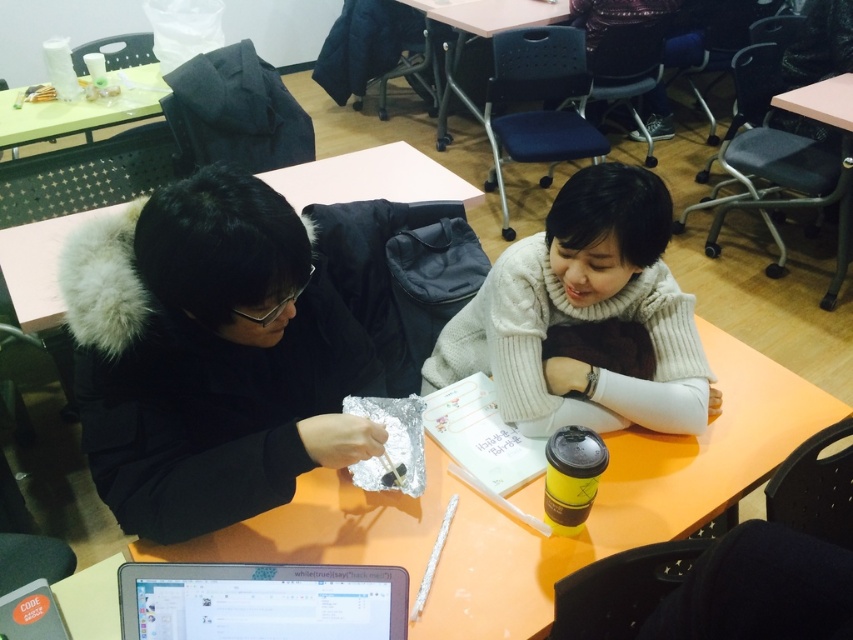
Question: Where is orange matte table at center located in relation to matte plastic table at center in the image?

Choices:
 (A) right
 (B) left

Answer: (B)

Question: Considering the real-world distances, which object is farthest from the matte plastic table at center?

Choices:
 (A) silver metallic laptop at center
 (B) white knitted sweater at center
 (C) green plastic table at upper left

Answer: (A)

Question: Observing the image, what is the correct spatial positioning of orange matte table at center in reference to matte pink table at upper center?

Choices:
 (A) left
 (B) right

Answer: (A)

Question: Which point is farther to the camera?

Choices:
 (A) orange matte table at center
 (B) white knitted sweater at center
 (C) matte plastic table at center
 (D) silver metallic laptop at center

Answer: (C)

Question: Which object is positioned closest to the green plastic table at upper left?

Choices:
 (A) matte plastic table at center
 (B) wooden table at upper right

Answer: (A)

Question: Can you confirm if silver metallic laptop at center is wider than matte pink table at upper center?

Choices:
 (A) yes
 (B) no

Answer: (B)